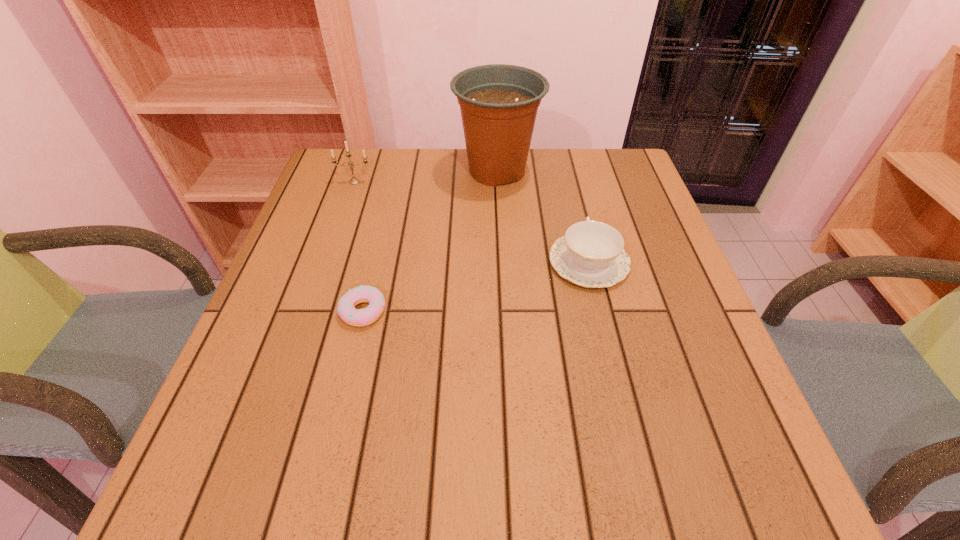
This screenshot has height=540, width=960. I want to click on blank space at the left edge of the desktop, so click(312, 337).

The image size is (960, 540). In the image, there is a desktop. Find the location of `free region at the right edge`. free region at the right edge is located at coordinates (648, 283).

Locate an element on the screen. free space at the far left corner of the desktop is located at coordinates (368, 183).

You are a GUI agent. You are given a task and a screenshot of the screen. Output one action in this format:
    pyautogui.click(x=<x>, y=<y>)
    Task: Click on the vacant space at the far right corner
    
    Given the screenshot: What is the action you would take?
    pyautogui.click(x=601, y=164)

At what (x,y) coordinates should I click in order to perform the action: click on free space at the near right corner of the desktop. Please return your answer as a coordinate pair (x, y). The width and height of the screenshot is (960, 540). Looking at the image, I should click on (787, 510).

The image size is (960, 540). What are the coordinates of `unoccupied area between the second object from left to right and the flowerpot` in the screenshot? It's located at (430, 241).

Where is `vacant region between the tallest object and the leftmost object`? This screenshot has width=960, height=540. vacant region between the tallest object and the leftmost object is located at coordinates (426, 177).

This screenshot has width=960, height=540. What are the coordinates of `vacant area between the shortest object and the third tallest object` in the screenshot? It's located at (476, 287).

Find the location of a particular element. free space between the tallest object and the chinaware is located at coordinates (543, 217).

The width and height of the screenshot is (960, 540). I want to click on free point between the flowerpot and the doughnut, so click(430, 241).